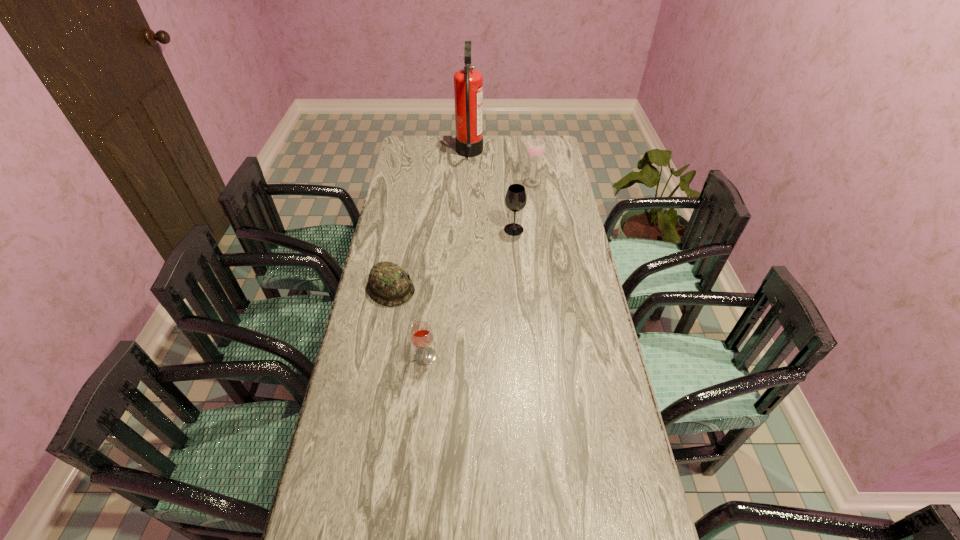
This screenshot has height=540, width=960. I want to click on vacant area located on the front-facing side of the farthest object, so click(538, 153).

Identify the location of vacant region located 0.330m on the back of the third farthest object. (510, 178).

Where is `free spot located on the back of the rightmost wineglass`? free spot located on the back of the rightmost wineglass is located at coordinates (527, 142).

The width and height of the screenshot is (960, 540). In order to click on free space located on the front of the shortest wineglass in this screenshot , I will do `click(419, 416)`.

The image size is (960, 540). What are the coordinates of `free spot located on the front of the shortest object` in the screenshot? It's located at (372, 383).

At what (x,y) coordinates should I click in order to perform the action: click on object located in the far edge section of the desktop. Please return your answer as a coordinate pair (x, y). This screenshot has width=960, height=540. Looking at the image, I should click on (468, 83).

Identify the location of object that is at the left edge. (388, 284).

Where is `object present at the right edge`? The image size is (960, 540). object present at the right edge is located at coordinates (536, 148).

Find the location of `blank space at the left edge of the desktop`. blank space at the left edge of the desktop is located at coordinates (403, 168).

Where is `free space at the right edge of the desktop`? The width and height of the screenshot is (960, 540). free space at the right edge of the desktop is located at coordinates (570, 249).